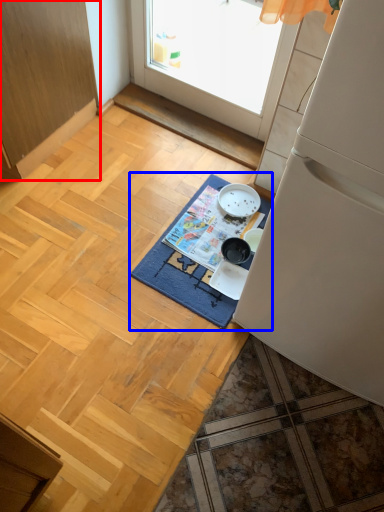
Question: Which of the following is the closest to the observer, cabinetry (highlighted by a red box) or mat (highlighted by a blue box)?

Choices:
 (A) cabinetry
 (B) mat

Answer: (A)